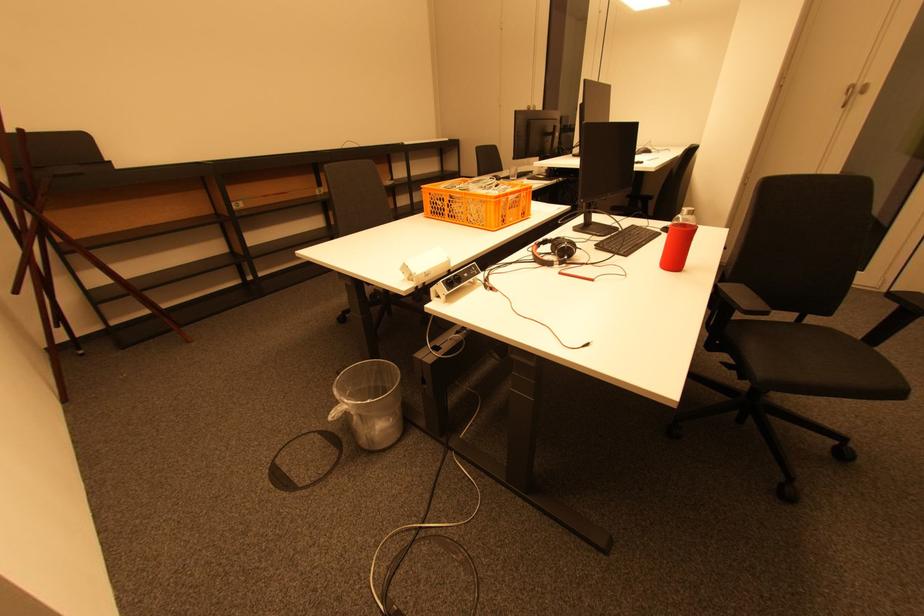
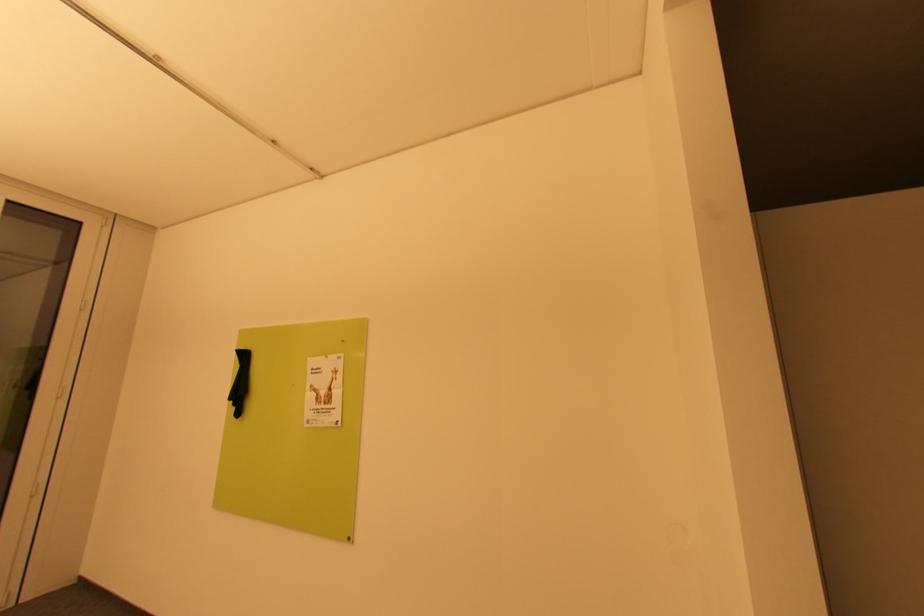
Question: The camera is either moving clockwise (left) or counter-clockwise (right) around the object. The first image is from the beginning of the video and the second image is from the end. Is the camera moving left or right when shooting the video?

Choices:
 (A) Left
 (B) Right

Answer: (A)